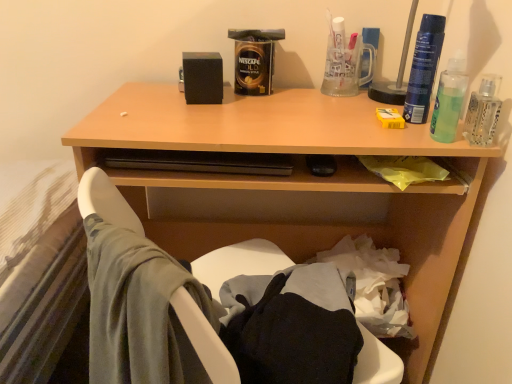
Question: Can we say wooden desk at upper center lies outside clear glass bottle at upper right, which appears as the 2th bottle when viewed from the left?

Choices:
 (A) yes
 (B) no

Answer: (A)

Question: Is wooden desk at upper center bigger than clear glass bottle at upper right, which appears as the 2th bottle when viewed from the left?

Choices:
 (A) no
 (B) yes

Answer: (B)

Question: Are wooden desk at upper center and clear glass bottle at upper right, the first bottle in the right-to-left sequence, located far from each other?

Choices:
 (A) yes
 (B) no

Answer: (B)

Question: Is wooden desk at upper center further to camera compared to clear glass bottle at upper right, which appears as the 2th bottle when viewed from the left?

Choices:
 (A) no
 (B) yes

Answer: (B)

Question: From the image's perspective, would you say wooden desk at upper center is positioned over clear glass bottle at upper right, the first bottle in the right-to-left sequence?

Choices:
 (A) no
 (B) yes

Answer: (A)

Question: Looking at their shapes, would you say clear glass bottle at upper right, which appears as the 2th bottle when viewed from the left, is wider or thinner than green translucent liquid at upper right?

Choices:
 (A) thin
 (B) wide

Answer: (A)

Question: From a real-world perspective, is clear glass bottle at upper right, which appears as the 2th bottle when viewed from the left, physically located above or below green translucent liquid at upper right?

Choices:
 (A) above
 (B) below

Answer: (B)

Question: Based on their sizes in the image, would you say clear glass bottle at upper right, which appears as the 2th bottle when viewed from the left, is bigger or smaller than green translucent liquid at upper right?

Choices:
 (A) small
 (B) big

Answer: (A)

Question: In the image, is clear glass bottle at upper right, which appears as the 2th bottle when viewed from the left, on the left side or the right side of green translucent liquid at upper right?

Choices:
 (A) right
 (B) left

Answer: (A)

Question: From the image's perspective, relative to blue plastic spray can at upper right, acting as the second bottle starting from the right, is clear glass bottle at upper right, which appears as the 2th bottle when viewed from the left, above or below?

Choices:
 (A) above
 (B) below

Answer: (B)

Question: In terms of height, does clear glass bottle at upper right, which appears as the 2th bottle when viewed from the left, look taller or shorter compared to blue plastic spray can at upper right, the 1th bottle viewed from the left?

Choices:
 (A) short
 (B) tall

Answer: (A)

Question: In the image, is clear glass bottle at upper right, the first bottle in the right-to-left sequence, on the left side or the right side of blue plastic spray can at upper right, the 1th bottle viewed from the left?

Choices:
 (A) right
 (B) left

Answer: (A)

Question: Does point (488, 74) appear closer or farther from the camera than point (424, 49)?

Choices:
 (A) closer
 (B) farther

Answer: (B)

Question: Looking at the image, does green translucent liquid at upper right seem bigger or smaller compared to clear glass bottle at upper right, which appears as the 2th bottle when viewed from the left?

Choices:
 (A) big
 (B) small

Answer: (A)

Question: Is point (456, 97) closer or farther from the camera than point (492, 79)?

Choices:
 (A) farther
 (B) closer

Answer: (B)